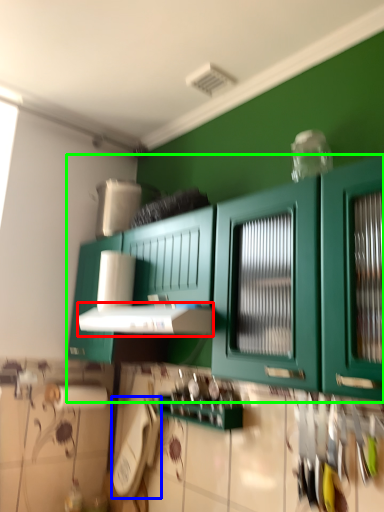
Question: Which object is positioned farthest from vent (highlighted by a red box)? Select from appliance (highlighted by a blue box) and cabinetry (highlighted by a green box).

Choices:
 (A) appliance
 (B) cabinetry

Answer: (A)